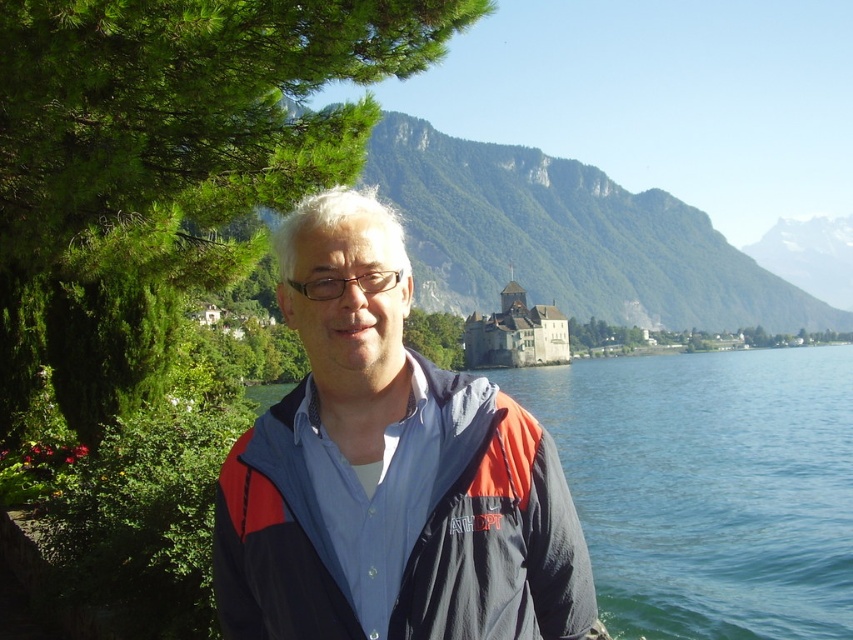
Does point (445, 388) come in front of point (509, 168)?

That is True.

Locate an element on the screen. blue fabric jacket at center is located at coordinates (387, 472).

Can you confirm if blue water at center is shorter than stone castle at center?

Indeed, blue water at center has a lesser height compared to stone castle at center.

Between blue water at center and stone castle at center, which one is positioned lower?

blue water at center

Does point (846, 385) come farther from viewer compared to point (517, 330)?

That is False.

Locate an element on the screen. Image resolution: width=853 pixels, height=640 pixels. blue water at center is located at coordinates (708, 486).

Is point (91, 61) positioned in front of point (519, 182)?

Yes, point (91, 61) is in front of point (519, 182).

Who is more forward, (177, 84) or (672, 292)?

Point (177, 84) is in front.

The height and width of the screenshot is (640, 853). What do you see at coordinates (164, 164) in the screenshot? I see `green leafy tree at upper left` at bounding box center [164, 164].

Where is `green leafy tree at upper left`? The image size is (853, 640). green leafy tree at upper left is located at coordinates (164, 164).